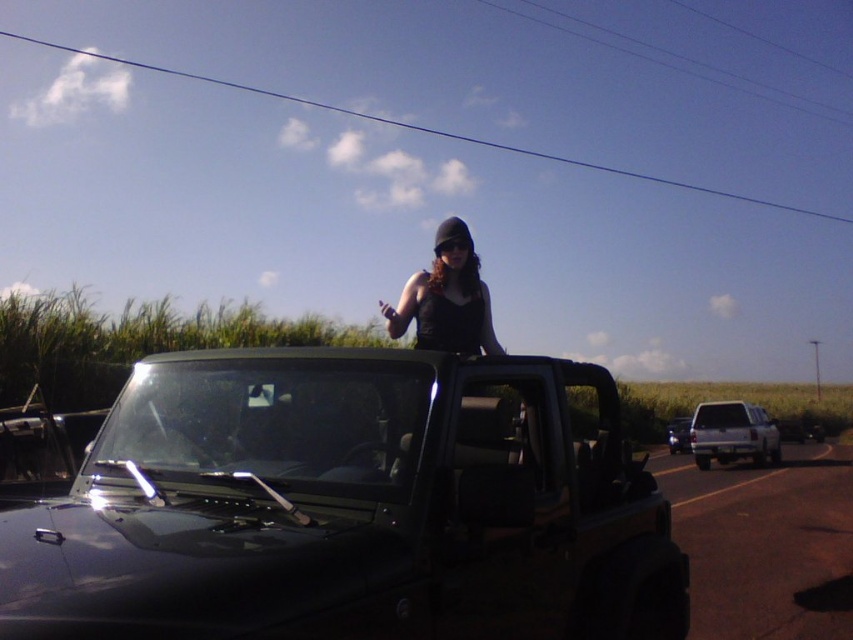
Which is behind, point (466, 620) or point (379, 438)?

The point (379, 438) is more distant.

Is point (67, 528) in front of point (152, 371)?

Yes, it is.

Image resolution: width=853 pixels, height=640 pixels. I want to click on black matte jeep at center, so click(x=350, y=506).

Is black matte jeep at center smaller than matte black tank top at center?

Actually, black matte jeep at center might be larger than matte black tank top at center.

Is black matte jeep at center shorter than matte black tank top at center?

No, black matte jeep at center is not shorter than matte black tank top at center.

Where is `black matte jeep at center`? The height and width of the screenshot is (640, 853). black matte jeep at center is located at coordinates (350, 506).

Does transparent glass windshield at center appear under matte black tank top at center?

Indeed, transparent glass windshield at center is positioned under matte black tank top at center.

Which is in front, point (280, 371) or point (461, 289)?

Positioned in front is point (280, 371).

What do you see at coordinates (270, 419) in the screenshot? Image resolution: width=853 pixels, height=640 pixels. I see `transparent glass windshield at center` at bounding box center [270, 419].

Where is `transparent glass windshield at center`? The image size is (853, 640). transparent glass windshield at center is located at coordinates (270, 419).